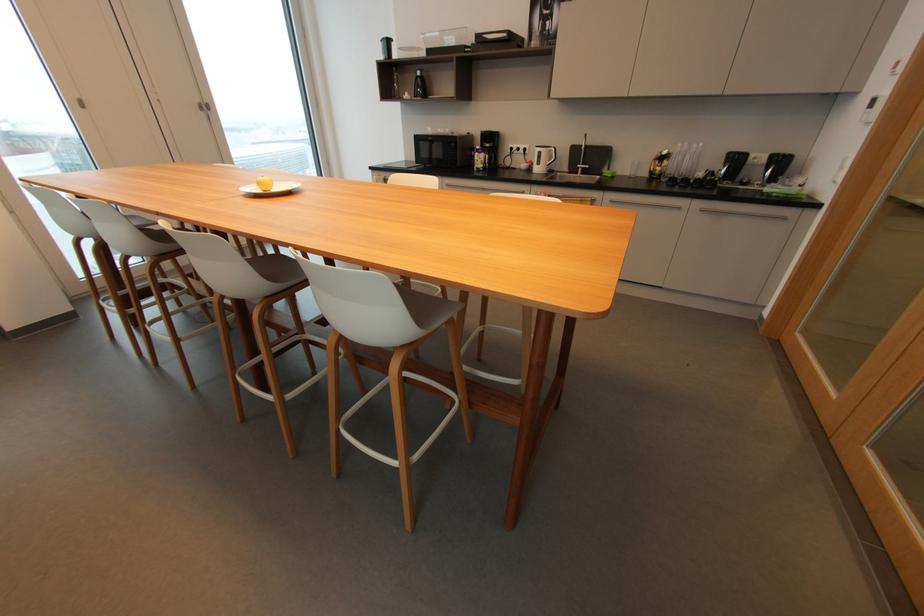
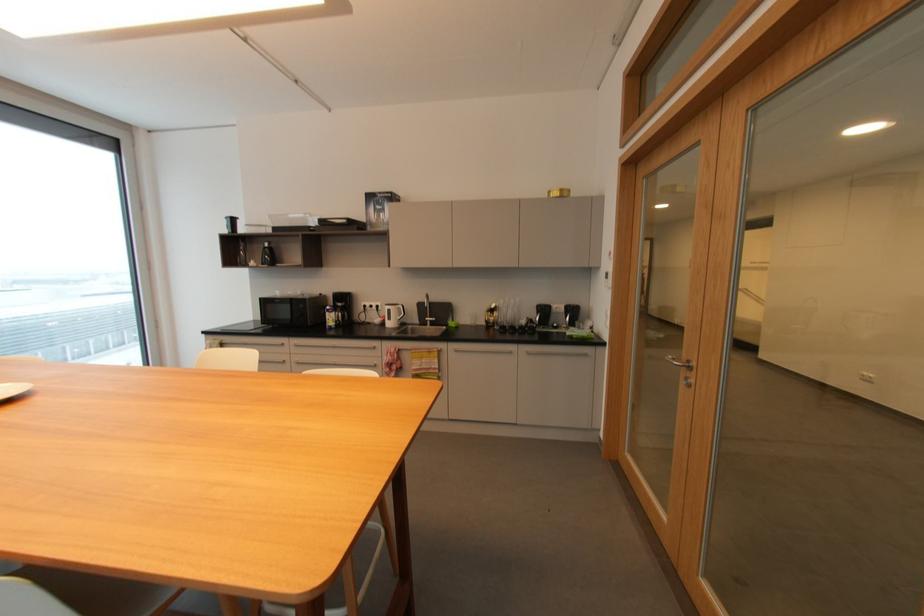
First-person continuous shooting, in which direction is the camera rotating?

The camera rotated toward right-up.